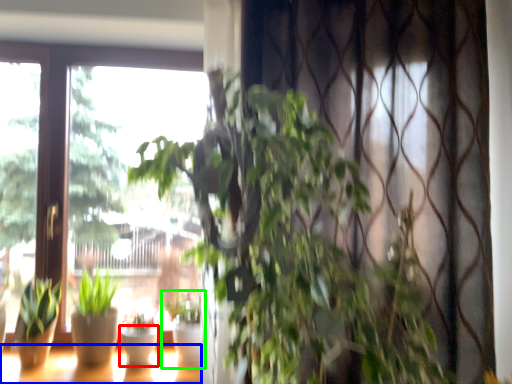
Question: Which object is the closest to the flowerpot (highlighted by a red box)? Choose among these: window (highlighted by a blue box) or houseplant (highlighted by a green box).

Choices:
 (A) window
 (B) houseplant

Answer: (A)